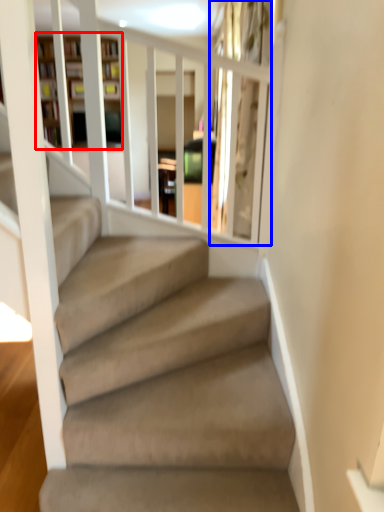
Question: Among these objects, which one is farthest to the camera, bookshelf (highlighted by a red box) or glass door (highlighted by a blue box)?

Choices:
 (A) bookshelf
 (B) glass door

Answer: (A)